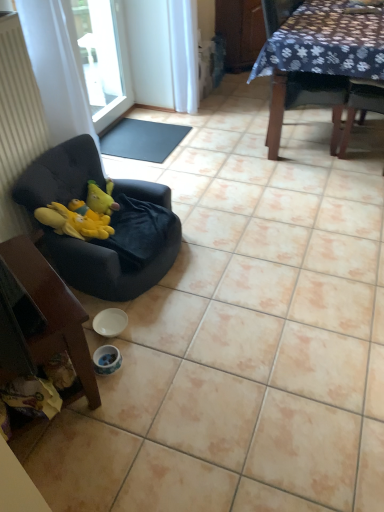
Question: Is velvet black chair at left, the second chair positioned from the left, to the left or to the right of wooden chair at lower left, acting as the third chair starting from the right, in the image?

Choices:
 (A) right
 (B) left

Answer: (A)

Question: In terms of width, does velvet black chair at left, the 2th chair from the front, look wider or thinner when compared to wooden chair at lower left, marked as the first chair in a bottom-to-top arrangement?

Choices:
 (A) thin
 (B) wide

Answer: (B)

Question: Which is farther from the white glossy bowl at lower center?

Choices:
 (A) dark fabric chair at upper right, the third chair ordered from the bottom
 (B) transparent glass window at upper left
 (C) velvet black chair at left, marked as the 2th chair in a bottom-to-top arrangement
 (D) black rubber mat at center
 (E) wooden chair at lower left, the first chair when ordered from front to back

Answer: (B)

Question: Estimate the real-world distances between objects in this image. Which object is farther from the black rubber mat at center?

Choices:
 (A) velvet black chair at left, the second chair when ordered from right to left
 (B) wooden chair at lower left, the first chair when ordered from front to back
 (C) transparent glass window at upper left
 (D) dark fabric chair at upper right, the third chair ordered from the bottom
 (E) white glossy bowl at lower center

Answer: (E)